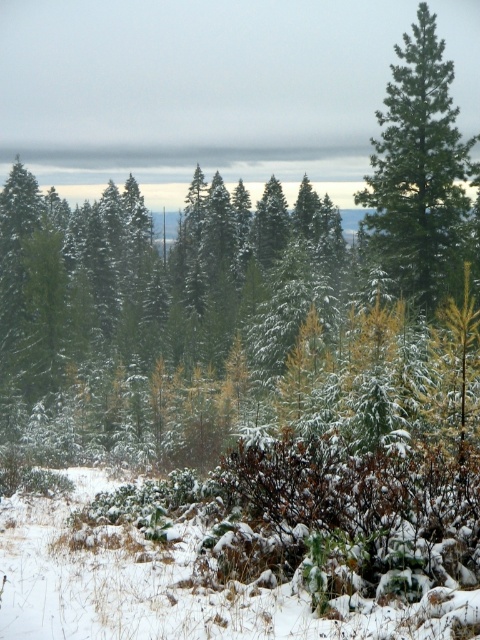
You are standing in the winter forest and notice the white fluffy snow at lower center and the green matte tree at upper right. Which object is positioned to the left of the other?

The white fluffy snow at lower center is to the left of the green matte tree at upper right.

You are a hiker trying to navigate through the winter forest. You see the white fluffy snow at lower center and the green matte tree at upper right. Which object is closer to you as you stand in the scene?

The white fluffy snow at lower center is closer to you because it is positioned in front of the green matte tree at upper right.